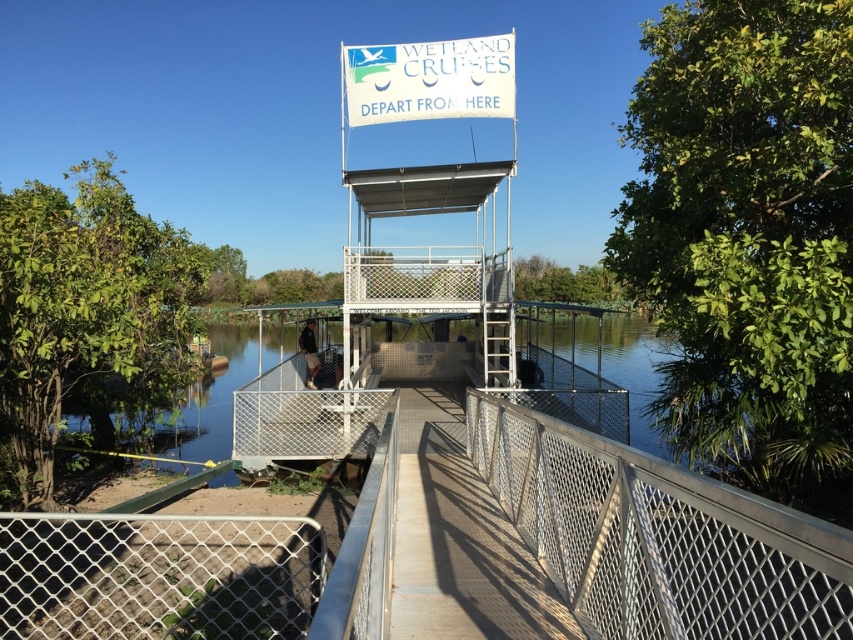
Question: Can you confirm if white mesh fence at center is positioned to the right of white metal observation tower at center?

Choices:
 (A) no
 (B) yes

Answer: (A)

Question: Can you confirm if white mesh fence at center is bigger than white metal observation tower at center?

Choices:
 (A) no
 (B) yes

Answer: (B)

Question: Can you confirm if white mesh fence at center is wider than white metal observation tower at center?

Choices:
 (A) no
 (B) yes

Answer: (B)

Question: Which object appears farthest from the camera in this image?

Choices:
 (A) white mesh fence at center
 (B) white metal observation tower at center

Answer: (B)

Question: Which point appears closest to the camera in this image?

Choices:
 (A) (368, 74)
 (B) (134, 618)

Answer: (B)